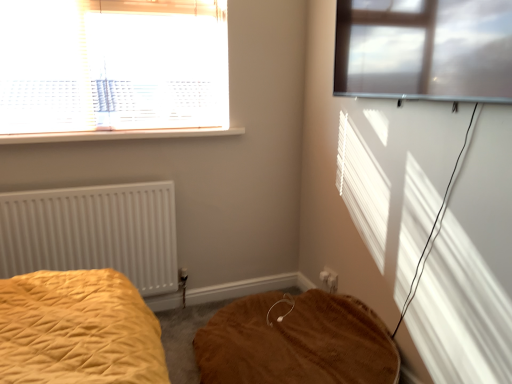
Question: Is white matte radiator at left bigger or smaller than brown plush mattress at lower center?

Choices:
 (A) small
 (B) big

Answer: (A)

Question: Based on their positions, is white matte radiator at left located to the left or right of brown plush mattress at lower center?

Choices:
 (A) right
 (B) left

Answer: (B)

Question: Which is nearer to the transparent glass window at upper right, the 1th window from the front?

Choices:
 (A) brown plush mattress at lower center
 (B) white plastic window sill at upper left
 (C) white plastic window at upper left, positioned as the 2th window in right-to-left order
 (D) white matte radiator at left
 (E) white plastic electric outlet at lower center

Answer: (B)

Question: Estimate the real-world distances between objects in this image. Which object is closer to the white plastic electric outlet at lower center?

Choices:
 (A) white plastic window sill at upper left
 (B) white plastic window at upper left, placed as the first window when sorted from back to front
 (C) white matte radiator at left
 (D) brown plush mattress at lower center
 (E) transparent glass window at upper right, placed as the 2th window when sorted from back to front

Answer: (D)